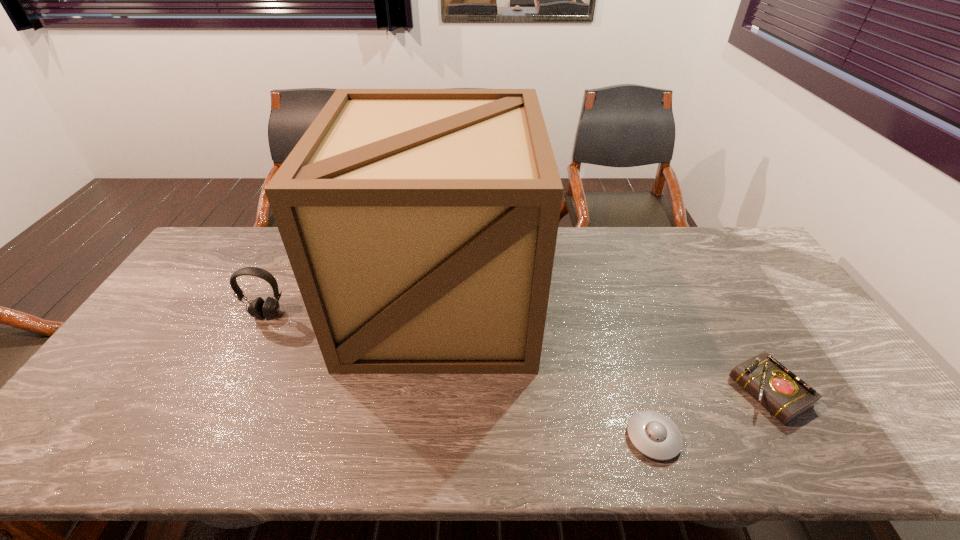
What are the coordinates of `the tallest object` in the screenshot? It's located at (420, 224).

The height and width of the screenshot is (540, 960). Find the location of `the second object from left to right`. the second object from left to right is located at coordinates (420, 224).

Find the location of `the second tallest object`. the second tallest object is located at coordinates (258, 308).

Where is `the leftmost object`? This screenshot has height=540, width=960. the leftmost object is located at coordinates (258, 308).

Image resolution: width=960 pixels, height=540 pixels. In order to click on diary in this screenshot , I will do `click(786, 396)`.

You are a GUI agent. You are given a task and a screenshot of the screen. Output one action in this format:
    pyautogui.click(x=<x>, y=<y>)
    Task: Click on the rightmost object
    Image resolution: width=960 pixels, height=540 pixels.
    Given the screenshot: What is the action you would take?
    pyautogui.click(x=786, y=396)

Locate an element on the screen. The image size is (960, 540). the second object from right to left is located at coordinates (656, 436).

Locate an element on the screen. the shortest object is located at coordinates (656, 436).

Where is `vacant area located 0.170m on the reinforced sides of the third object from right to left`? vacant area located 0.170m on the reinforced sides of the third object from right to left is located at coordinates (428, 434).

Image resolution: width=960 pixels, height=540 pixels. I want to click on vacant region located on the front-facing side of the headset, so click(228, 390).